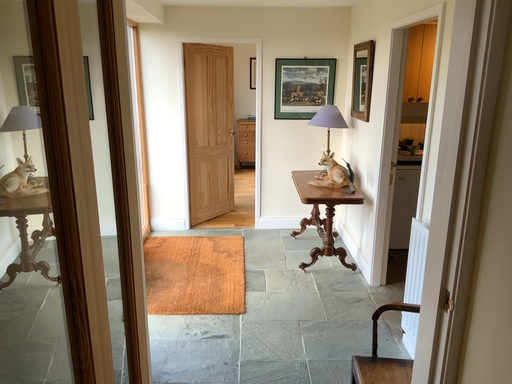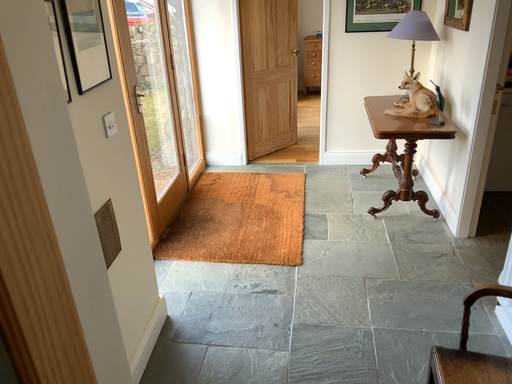
Question: Which way did the camera rotate in the video?

Choices:
 (A) rotated upward
 (B) rotated downward

Answer: (B)